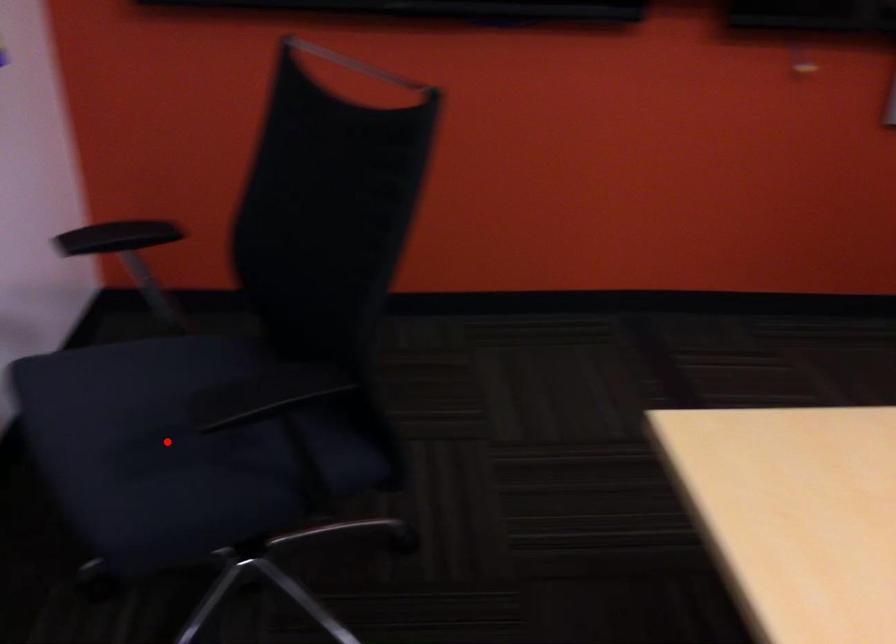
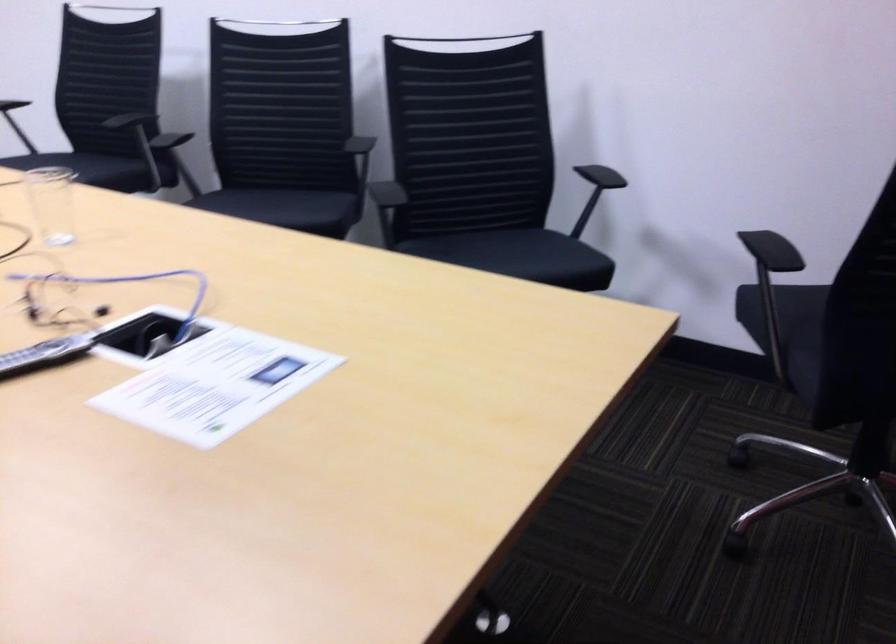
Question: I am providing you with two images of the same scene from different viewpoints. A red point is marked on the first image. Is the red point's position out of view in image 2?

Choices:
 (A) Yes
 (B) No

Answer: (A)